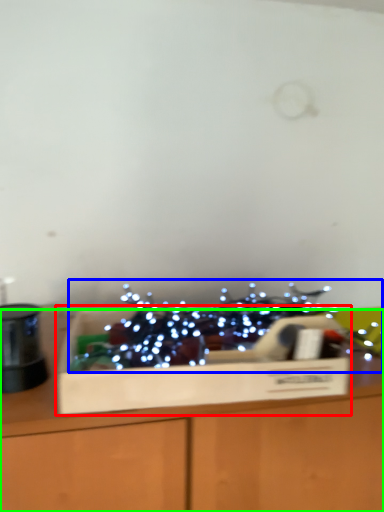
Question: Which object is positioned closest to cardboard box (highlighted by a red box)? Select from christmas decoration (highlighted by a blue box) and table (highlighted by a green box).

Choices:
 (A) christmas decoration
 (B) table

Answer: (B)